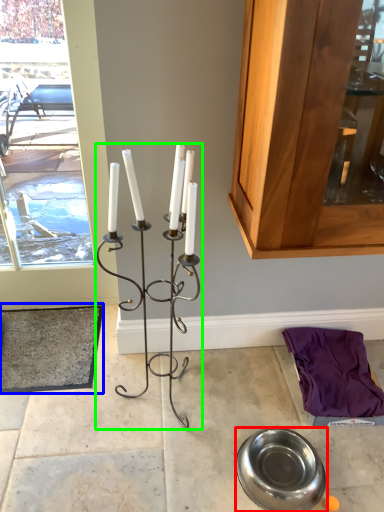
Question: Estimate the real-world distances between objects in this image. Which object is closer to tableware (highlighted by a red box), doormat (highlighted by a blue box) or candle holder (highlighted by a green box)?

Choices:
 (A) doormat
 (B) candle holder

Answer: (B)